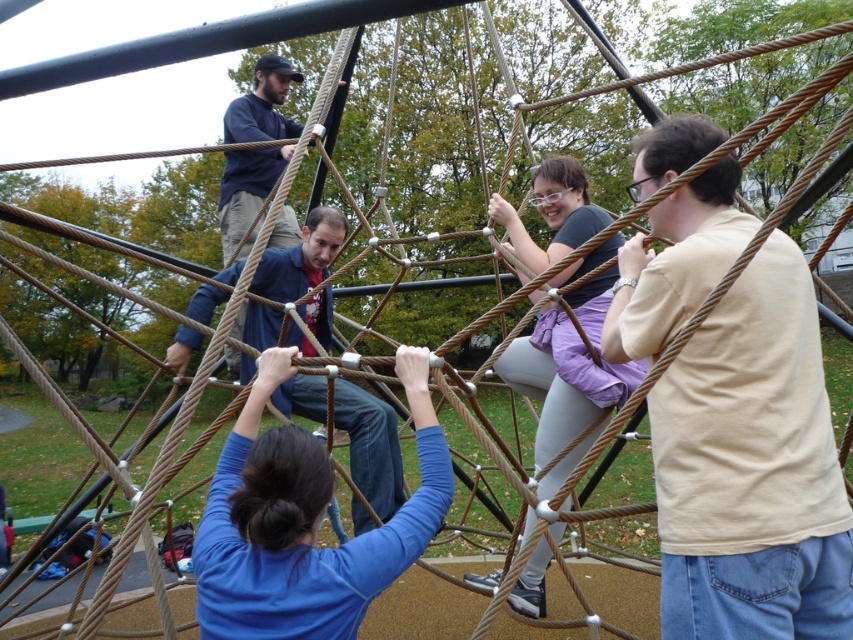
Question: Which of the following is the farthest from the observer?

Choices:
 (A) (281, 561)
 (B) (569, 186)
 (C) (384, 410)
 (D) (271, 96)

Answer: (D)

Question: In this image, where is beige cotton shirt at upper right located relative to blue denim jeans at center?

Choices:
 (A) left
 (B) right

Answer: (B)

Question: Does matte purple pants at center appear over dark blue sweater at upper center?

Choices:
 (A) no
 (B) yes

Answer: (A)

Question: Among these points, which one is farthest from the camera?

Choices:
 (A) (244, 412)
 (B) (244, 108)
 (C) (770, 417)

Answer: (B)

Question: Does beige cotton shirt at upper right have a greater width compared to blue denim jeans at center?

Choices:
 (A) yes
 (B) no

Answer: (B)

Question: Which of the following is the farthest from the observer?

Choices:
 (A) blue denim jeans at center
 (B) dark blue sweater at upper center
 (C) matte purple pants at center

Answer: (B)